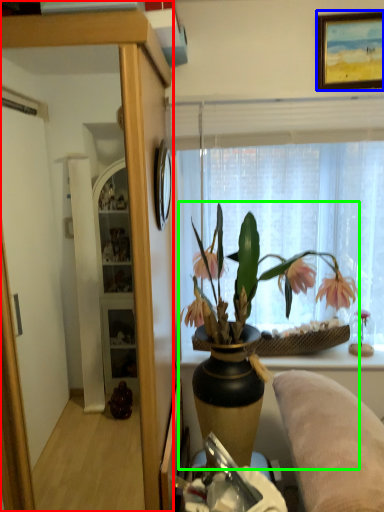
Question: Considering the real-world distances, which object is closest to cabinetry (highlighted by a red box)? picture frame (highlighted by a blue box) or houseplant (highlighted by a green box).

Choices:
 (A) picture frame
 (B) houseplant

Answer: (B)